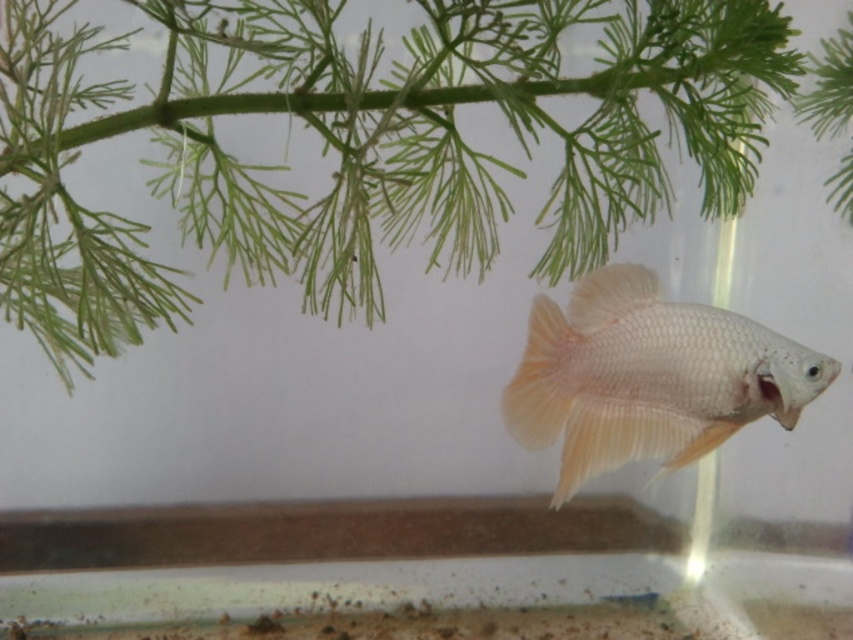
You are an underwater photographer aiming to capture the translucent white fish at center and the green leafy plant at upper center in the same frame. Based on their sizes, which object will occupy more space in your photo?

The green leafy plant at upper center will occupy more space in the photo because its width surpasses that of the translucent white fish at center.

You are a small aquatic creature swimming in the aquarium. You see the green leafy plant at upper center and the translucent white fish at center. Which object is closer to you?

The green leafy plant at upper center is closer to you than the translucent white fish at center because it is further to the viewer.